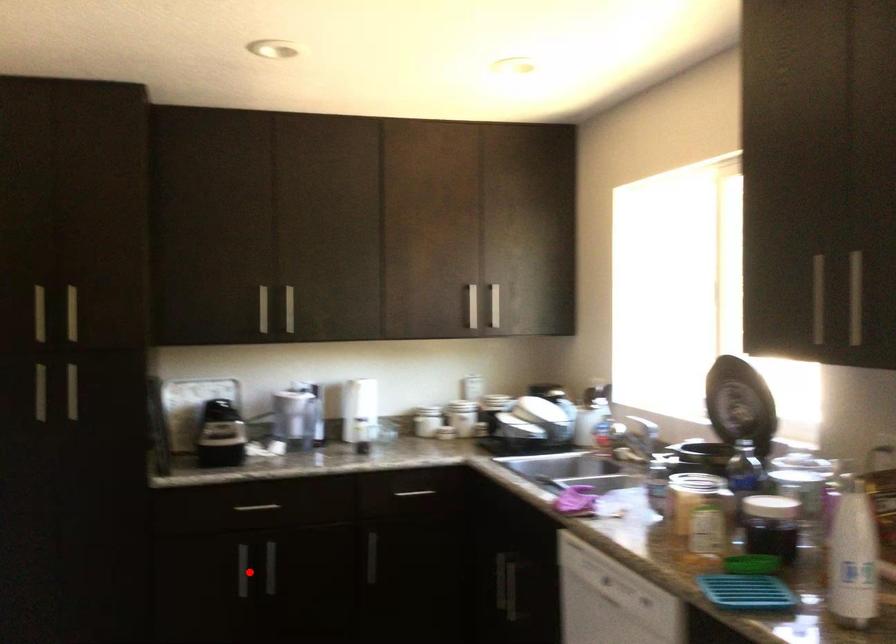
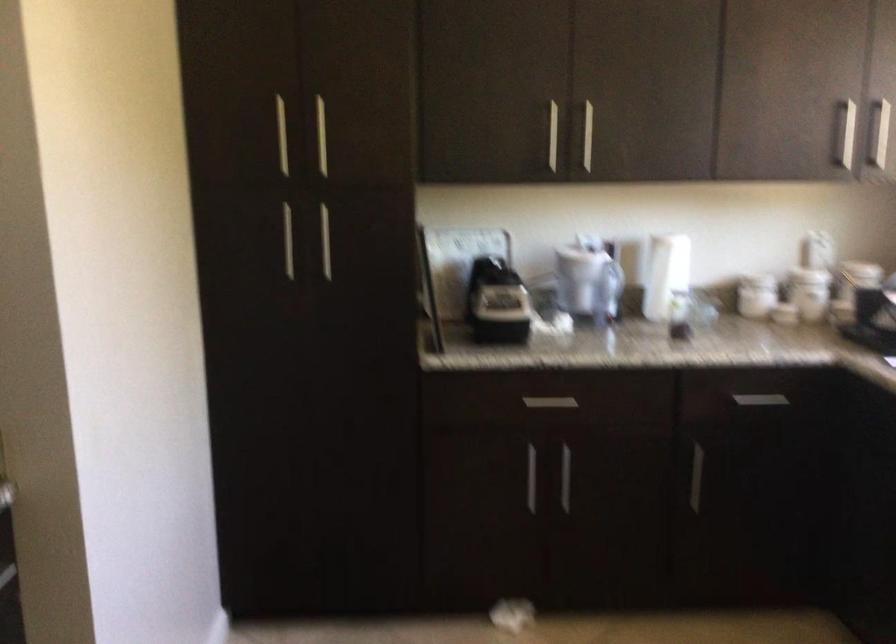
Locate, in the second image, the point that corresponds to the highlighted location in the first image.

(530, 478)